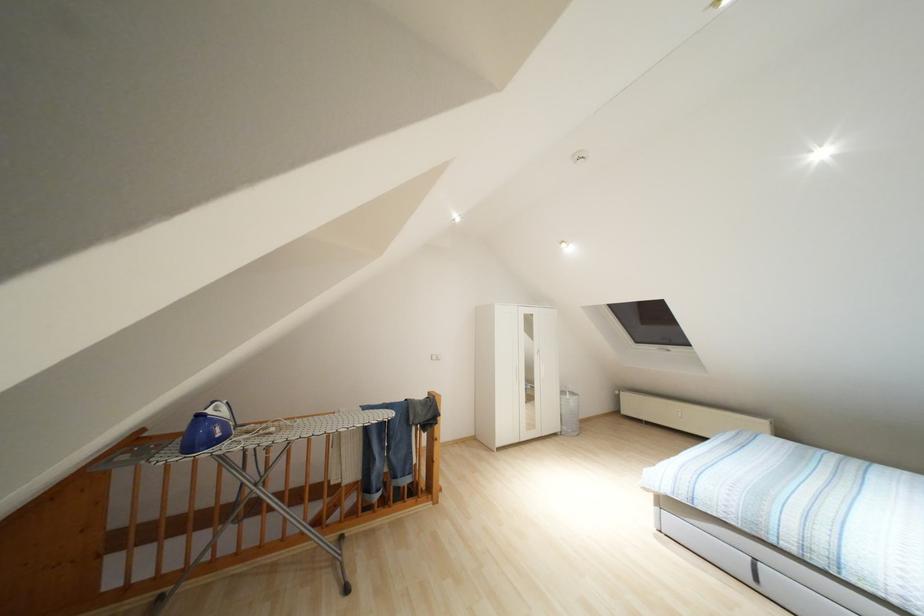
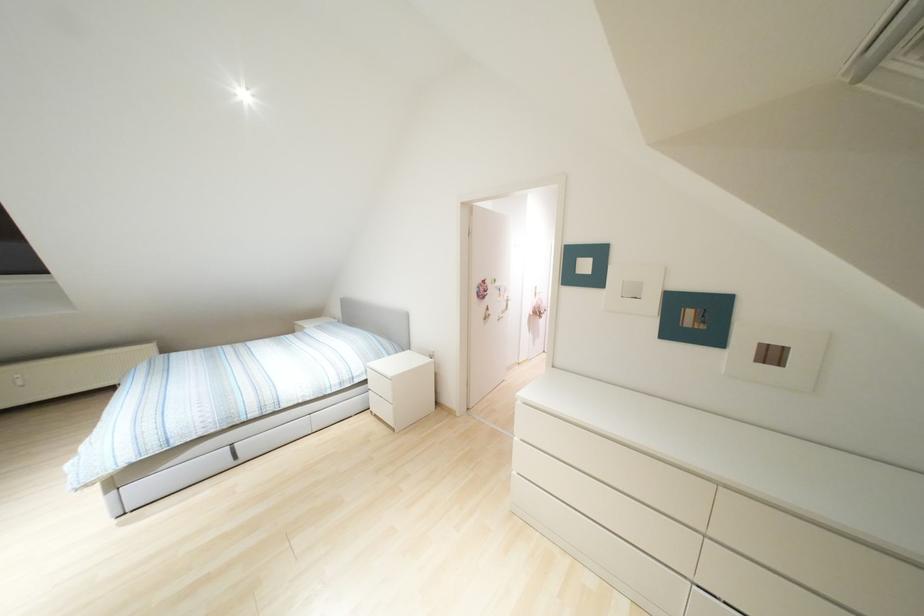
Locate, in the second image, the point that corresponds to (x=756, y=578) in the first image.

(235, 456)